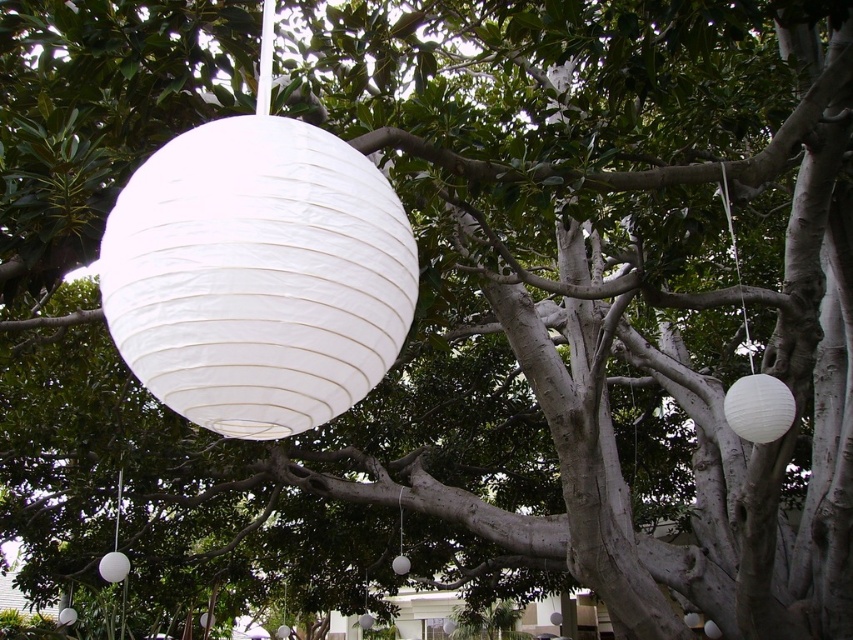
You are planning to hang a new white paper lantern between the existing ones in the tree. Based on the current arrangement of the white paper lantern at upper right and the white paper lantern at lower left, which lantern should you use as a reference for height to ensure the new lantern is positioned correctly?

The white paper lantern at upper right is not as tall as the white paper lantern at lower left, so you should use the white paper lantern at lower left as a reference for height to ensure the new lantern is positioned correctly.